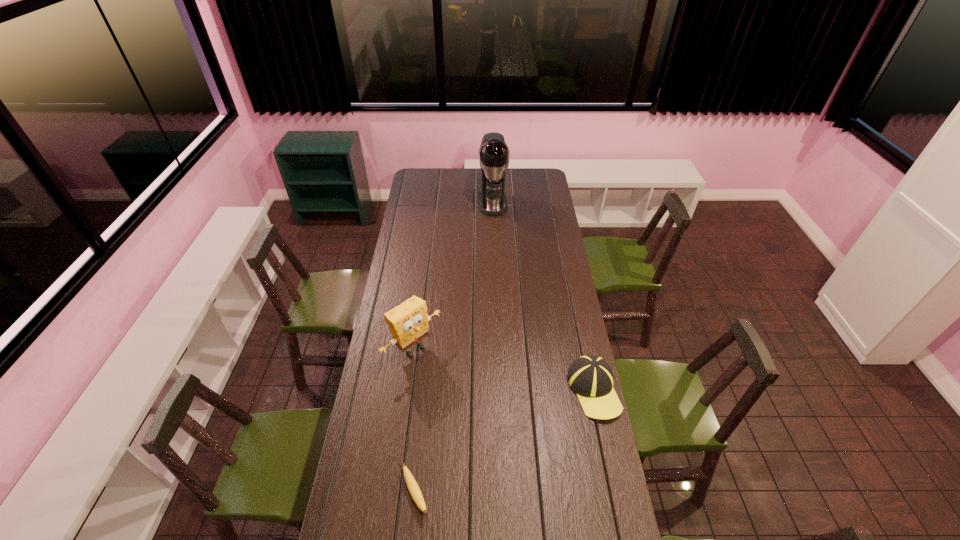
The width and height of the screenshot is (960, 540). I want to click on free space between the banana and the baseball cap, so click(504, 442).

This screenshot has height=540, width=960. I want to click on free space between the coffee maker and the nearest object, so click(454, 348).

The height and width of the screenshot is (540, 960). In order to click on free space between the sponge and the baseball cap in this screenshot , I will do `click(504, 369)`.

Identify the location of free point between the shortest object and the rightmost object. The width and height of the screenshot is (960, 540). (504, 442).

What are the coordinates of `free spot between the coffee maker and the baseball cap` in the screenshot? It's located at (543, 296).

The width and height of the screenshot is (960, 540). In order to click on free space that is in between the second tallest object and the rightmost object in this screenshot , I will do `click(504, 369)`.

Find the location of a particular element. The height and width of the screenshot is (540, 960). free area in between the rightmost object and the shortest object is located at coordinates [x=504, y=442].

What are the coordinates of `free spot between the second tallest object and the baseball cap` in the screenshot? It's located at (504, 369).

Identify the location of vacant space that is in between the sponge and the third object from left to right. (453, 276).

Find the location of a particular element. unoccupied position between the third object from left to right and the baseball cap is located at coordinates (543, 296).